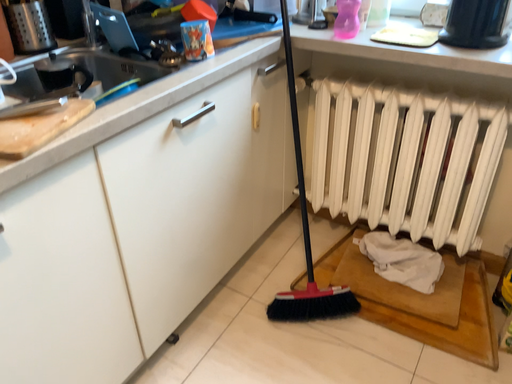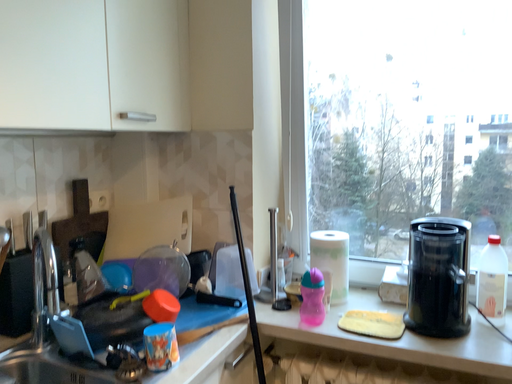
Question: How did the camera likely rotate when shooting the video?

Choices:
 (A) rotated downward
 (B) rotated upward

Answer: (B)